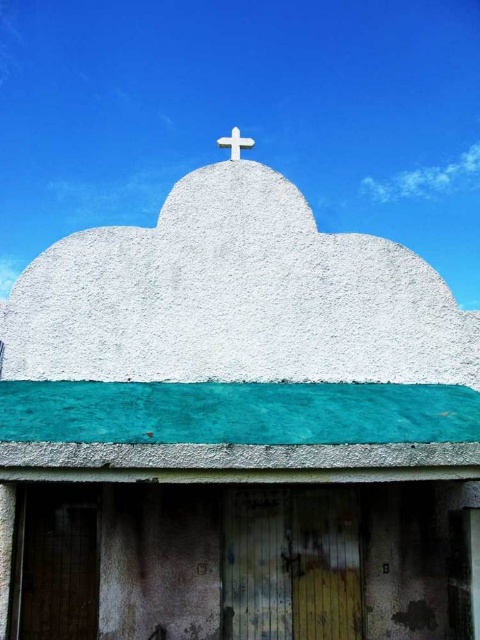
Can you confirm if white rough concrete cloud at upper left is smaller than white stone cross at upper center?

No.

Where is `white rough concrete cloud at upper left`? The image size is (480, 640). white rough concrete cloud at upper left is located at coordinates (9, 273).

Is point (3, 284) in front of point (251, 141)?

No, it is not.

Locate an element on the screen. This screenshot has width=480, height=640. white rough concrete cloud at upper left is located at coordinates (9, 273).

Can you confirm if white fluffy cloud at upper center is shorter than white rough concrete cloud at upper left?

No, white fluffy cloud at upper center is not shorter than white rough concrete cloud at upper left.

Can you confirm if white fluffy cloud at upper center is taller than white rough concrete cloud at upper left?

Yes.

The width and height of the screenshot is (480, 640). I want to click on white fluffy cloud at upper center, so click(428, 179).

The width and height of the screenshot is (480, 640). In order to click on white fluffy cloud at upper center in this screenshot , I will do `click(428, 179)`.

Who is positioned more to the left, white fluffy cloud at upper center or white stone cross at upper center?

From the viewer's perspective, white stone cross at upper center appears more on the left side.

How much distance is there between white fluffy cloud at upper center and white stone cross at upper center?

white fluffy cloud at upper center and white stone cross at upper center are 21.58 feet apart from each other.

Which is in front, point (472, 163) or point (231, 144)?

Positioned in front is point (231, 144).

The width and height of the screenshot is (480, 640). Identify the location of white fluffy cloud at upper center. (428, 179).